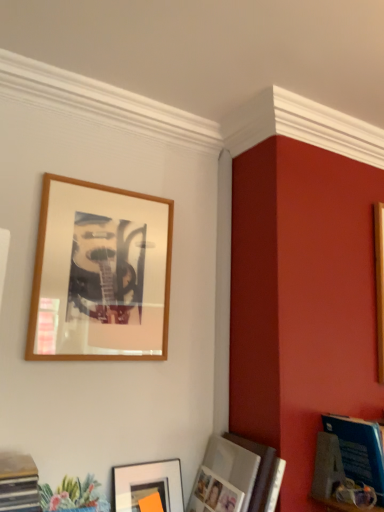
Question: Does matte black picture frame at lower center, which appears as the 1th picture frame when ordered from the bottom, appear on the right side of blue glossy magazine at lower right?

Choices:
 (A) yes
 (B) no

Answer: (B)

Question: Does matte black picture frame at lower center, which appears as the 1th picture frame when ordered from the bottom, have a greater height compared to blue glossy magazine at lower right?

Choices:
 (A) yes
 (B) no

Answer: (A)

Question: Does matte black picture frame at lower center, which is counted as the third picture frame, starting from the top, lie in front of blue glossy magazine at lower right?

Choices:
 (A) no
 (B) yes

Answer: (A)

Question: From a real-world perspective, does matte black picture frame at lower center, which is counted as the third picture frame, starting from the top, sit lower than blue glossy magazine at lower right?

Choices:
 (A) no
 (B) yes

Answer: (B)

Question: From the image's perspective, would you say matte black picture frame at lower center, which appears as the 1th picture frame when ordered from the bottom, is shown under blue glossy magazine at lower right?

Choices:
 (A) yes
 (B) no

Answer: (A)

Question: In terms of height, does blue glossy magazine at lower right look taller or shorter compared to matte silver photo frame at lower right, the 2th picture frame when ordered from top to bottom?

Choices:
 (A) short
 (B) tall

Answer: (A)

Question: From a real-world perspective, is blue glossy magazine at lower right physically located above or below matte silver photo frame at lower right, which ranks as the 2th picture frame in bottom-to-top order?

Choices:
 (A) above
 (B) below

Answer: (A)

Question: Considering the relative positions of blue glossy magazine at lower right and matte silver photo frame at lower right, which ranks as the 2th picture frame in bottom-to-top order, in the image provided, is blue glossy magazine at lower right to the left or to the right of matte silver photo frame at lower right, which ranks as the 2th picture frame in bottom-to-top order,?

Choices:
 (A) left
 (B) right

Answer: (B)

Question: From the image's perspective, is blue glossy magazine at lower right above or below matte silver photo frame at lower right, the 2th picture frame when ordered from top to bottom?

Choices:
 (A) above
 (B) below

Answer: (A)

Question: Considering the relative positions of blue glossy magazine at lower right and matte black picture frame at lower center, which is counted as the third picture frame, starting from the top, in the image provided, is blue glossy magazine at lower right to the left or to the right of matte black picture frame at lower center, which is counted as the third picture frame, starting from the top,?

Choices:
 (A) left
 (B) right

Answer: (B)

Question: Is blue glossy magazine at lower right bigger or smaller than matte black picture frame at lower center, which is counted as the third picture frame, starting from the top?

Choices:
 (A) small
 (B) big

Answer: (B)

Question: Is blue glossy magazine at lower right inside or outside of matte black picture frame at lower center, which is counted as the third picture frame, starting from the top?

Choices:
 (A) inside
 (B) outside

Answer: (B)

Question: From a real-world perspective, is blue glossy magazine at lower right physically located above or below matte black picture frame at lower center, which is counted as the third picture frame, starting from the top?

Choices:
 (A) below
 (B) above

Answer: (B)

Question: Considering the positions of point (137, 478) and point (374, 429), is point (137, 478) closer or farther from the camera than point (374, 429)?

Choices:
 (A) farther
 (B) closer

Answer: (A)

Question: From a real-world perspective, relative to blue glossy magazine at lower right, is matte black picture frame at lower center, which is counted as the third picture frame, starting from the top, vertically above or below?

Choices:
 (A) above
 (B) below

Answer: (B)